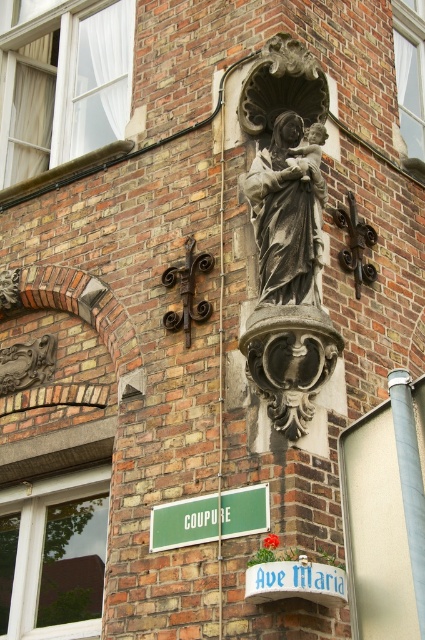
Question: Is gray stone statue at center further to the viewer compared to green matte sign at lower center?

Choices:
 (A) no
 (B) yes

Answer: (B)

Question: Which point appears closest to the camera in this image?

Choices:
 (A) (265, 234)
 (B) (192, 540)

Answer: (B)

Question: Is gray stone statue at center thinner than green matte sign at lower center?

Choices:
 (A) no
 (B) yes

Answer: (B)

Question: From the image, what is the correct spatial relationship of gray stone statue at center in relation to green matte sign at lower center?

Choices:
 (A) below
 (B) above

Answer: (B)